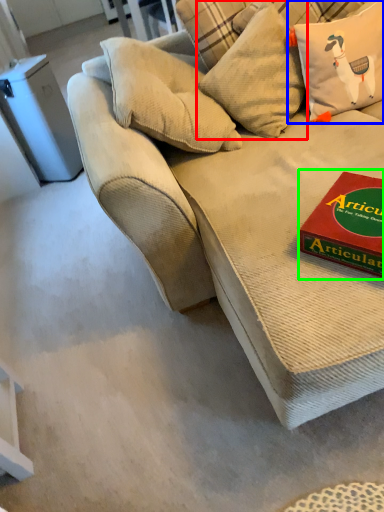
Question: Which object is the farthest from pillow (highlighted by a red box)? Choose among these: pillow (highlighted by a blue box) or paperback book (highlighted by a green box).

Choices:
 (A) pillow
 (B) paperback book

Answer: (B)